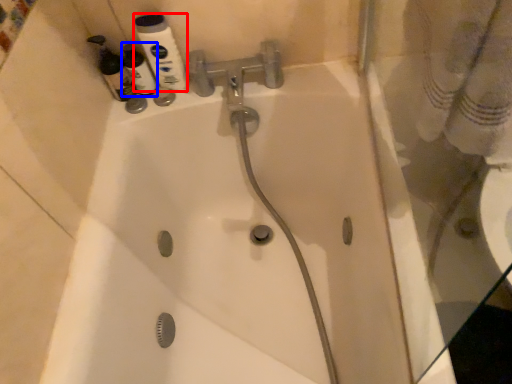
Question: Which object is closer to the camera taking this photo, mouthwash (highlighted by a red box) or cleaning product (highlighted by a blue box)?

Choices:
 (A) mouthwash
 (B) cleaning product

Answer: (A)